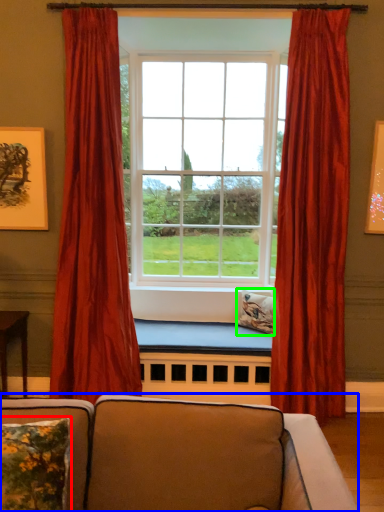
Question: Which is nearer to the pillow (highlighted by a red box)? studio couch (highlighted by a blue box) or pillow (highlighted by a green box).

Choices:
 (A) studio couch
 (B) pillow

Answer: (A)